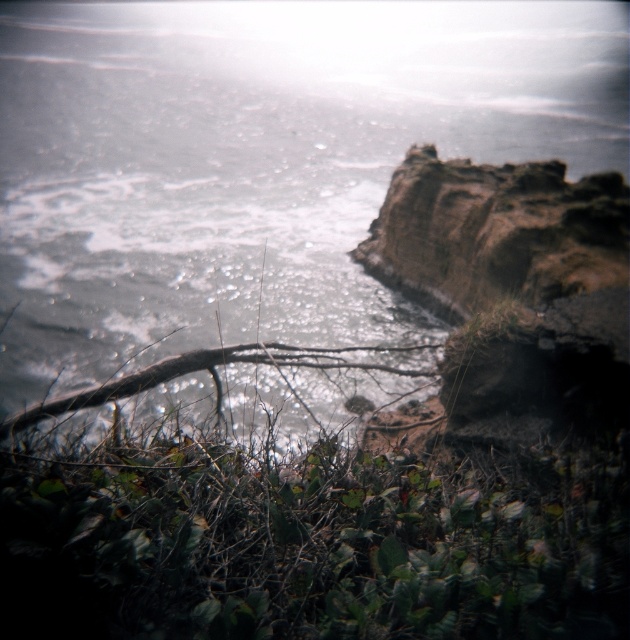
Question: In this image, where is glistening water at cliff edge located relative to green leafy vegetation at center?

Choices:
 (A) below
 (B) above

Answer: (B)

Question: Which of the following is the farthest from the observer?

Choices:
 (A) (x=38, y=572)
 (B) (x=249, y=180)

Answer: (B)

Question: Is glistening water at cliff edge smaller than green leafy vegetation at center?

Choices:
 (A) no
 (B) yes

Answer: (A)

Question: Among these points, which one is nearest to the camera?

Choices:
 (A) (52, 472)
 (B) (115, 264)

Answer: (A)

Question: Which of the following is the farthest from the observer?

Choices:
 (A) (180, 200)
 (B) (292, 620)

Answer: (A)

Question: Is glistening water at cliff edge below green leafy vegetation at center?

Choices:
 (A) no
 (B) yes

Answer: (A)